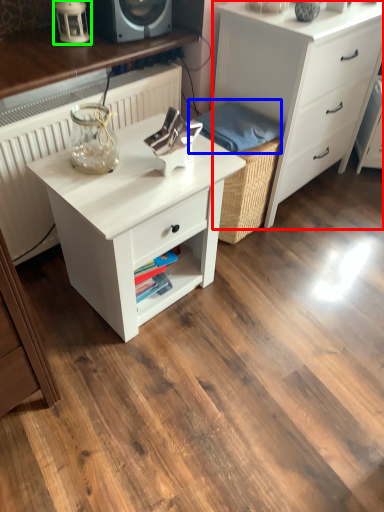
Question: Which object is the farthest from chest of drawers (highlighted by a red box)? Choose among these: material (highlighted by a blue box) or table lamp (highlighted by a green box).

Choices:
 (A) material
 (B) table lamp

Answer: (B)